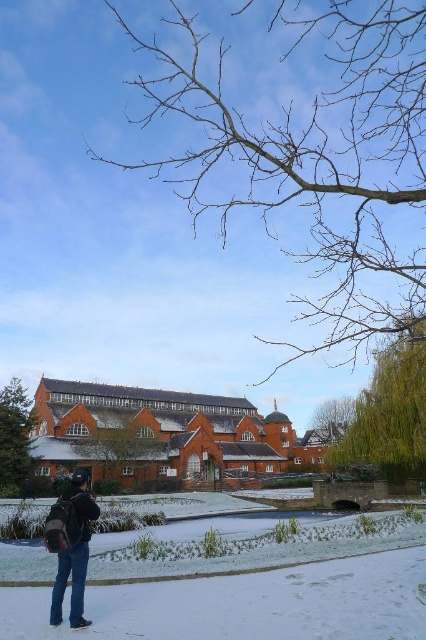
Question: Is brown textured tree at center below green leafy tree at upper center?

Choices:
 (A) no
 (B) yes

Answer: (A)

Question: Which is farther from the green leafy tree at upper center?

Choices:
 (A) matte black backpack at lower left
 (B) green leafy tree at center
 (C) bare branches at upper center
 (D) brown textured tree at center

Answer: (A)

Question: Does green leafy tree at center have a larger size compared to green leafy tree at upper center?

Choices:
 (A) no
 (B) yes

Answer: (B)

Question: Which object appears farthest from the camera in this image?

Choices:
 (A) brown textured tree at center
 (B) green leafy tree at lower left
 (C) white powdery snow at lower center
 (D) green leafy tree at center

Answer: (A)

Question: Can you confirm if green leafy tree at center is positioned to the left of green leafy tree at upper center?

Choices:
 (A) no
 (B) yes

Answer: (B)

Question: Which point is farther to the camera?

Choices:
 (A) green leafy tree at lower left
 (B) white powdery snow at lower center
 (C) green leafy tree at center

Answer: (A)